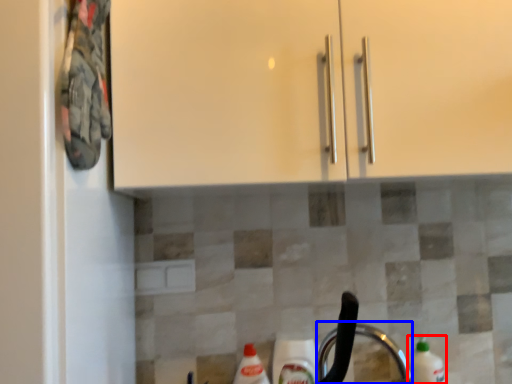
Question: Which of the following is the farthest to the observer, cleaning product (highlighted by a red box) or faucet (highlighted by a blue box)?

Choices:
 (A) cleaning product
 (B) faucet

Answer: (A)